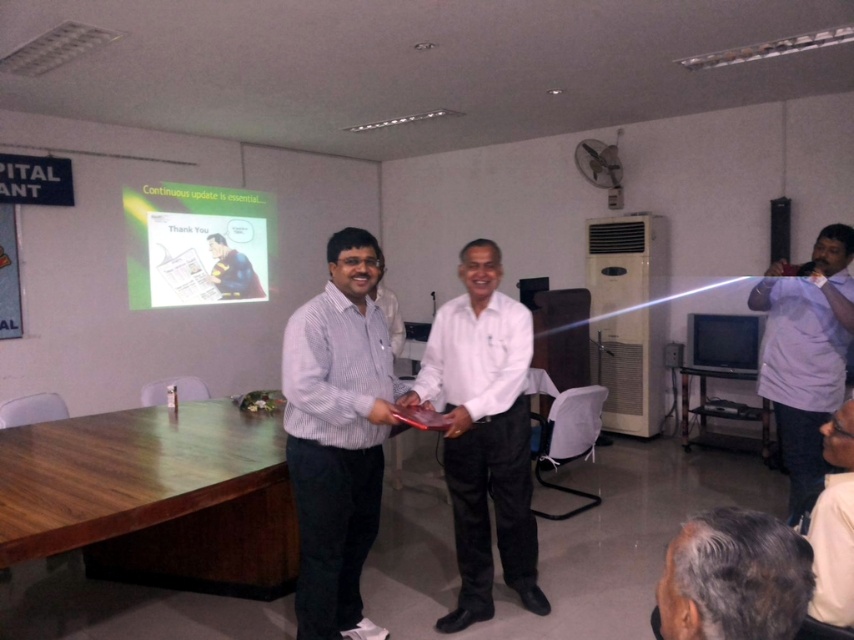
You are a photographer in the conference room. You need to capture a photo of the white glossy shirt at center and the metallic silver table at center. According to the scene description, which object is positioned higher in the image?

The white glossy shirt at center is above the metallic silver table at center, so it is positioned higher in the image.

You are standing in the conference room and see two points marked in the image. Which point is closer to you, point at coordinates [460,529] or point at coordinates [837,524]?

Point at coordinates [460,529] is closer to you than point at coordinates [837,524] because it is further to the viewer.